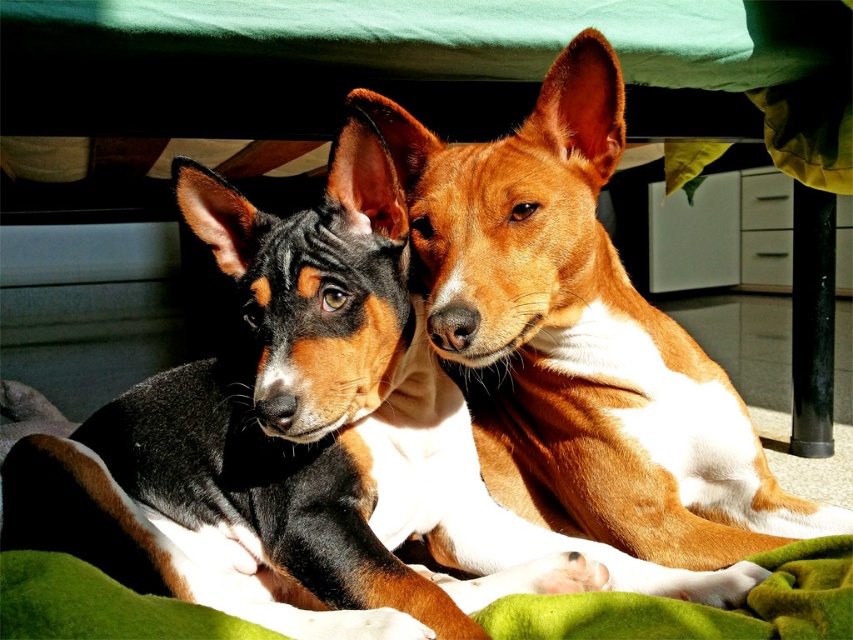
Question: Can you confirm if black and tan fur dog at center is positioned above brown/white fur dog at center?

Choices:
 (A) yes
 (B) no

Answer: (B)

Question: Is black and tan fur dog at center to the right of brown/white fur dog at center from the viewer's perspective?

Choices:
 (A) yes
 (B) no

Answer: (B)

Question: Is black and tan fur dog at center below brown/white fur dog at center?

Choices:
 (A) yes
 (B) no

Answer: (A)

Question: Which point appears closest to the camera in this image?

Choices:
 (A) (381, 195)
 (B) (685, 376)

Answer: (A)